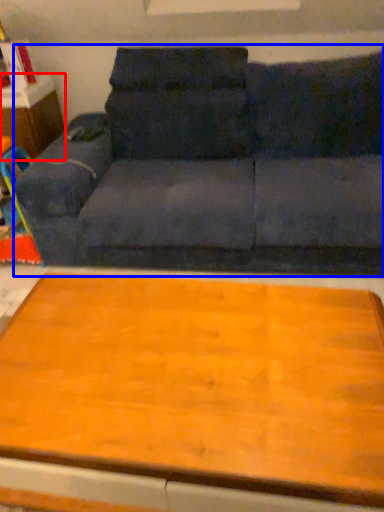
Question: Among these objects, which one is farthest to the camera, dresser (highlighted by a red box) or studio couch (highlighted by a blue box)?

Choices:
 (A) dresser
 (B) studio couch

Answer: (A)